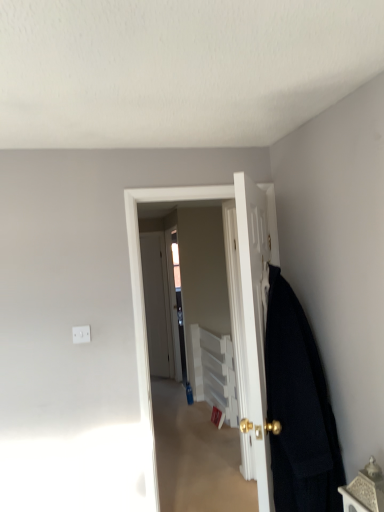
This screenshot has width=384, height=512. In order to click on vacant space in clear glass screen door at center (from a real-world perspective) in this screenshot , I will do `click(183, 392)`.